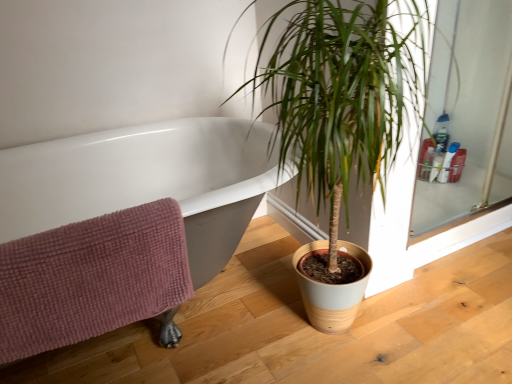
Find the location of `vacant area that lies to the right of translucent plastic bottles at upper right, the 2th toiletry in the right-to-left sequence`. vacant area that lies to the right of translucent plastic bottles at upper right, the 2th toiletry in the right-to-left sequence is located at coordinates (x=468, y=187).